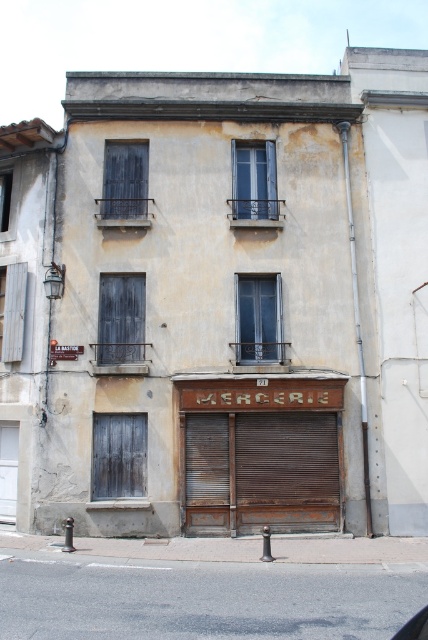
You are standing in front of the two story building described. You need to find the location of the brown corrugated metal at center. Based on the coordinates provided, where would you look relative to the building?

The brown corrugated metal at center is located at coordinates point (287, 458), which places it near the lower right area of the building. Since the building has a weathered facade, you should look for it on the lower floor around the central to right side area.